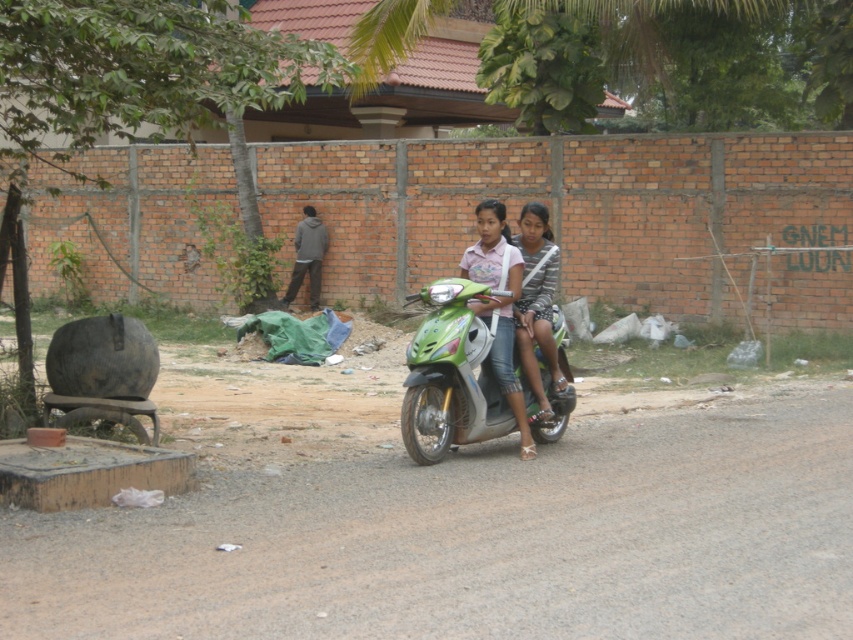
Where is `dirt track at lower center`? The height and width of the screenshot is (640, 853). dirt track at lower center is located at coordinates (480, 538).

The height and width of the screenshot is (640, 853). What are the coordinates of `dirt track at lower center` in the screenshot? It's located at (480, 538).

Between dirt track at lower center and striped fabric dress at center, which one is positioned higher?

Positioned higher is striped fabric dress at center.

Does dirt track at lower center have a greater height compared to striped fabric dress at center?

Incorrect, dirt track at lower center's height is not larger of striped fabric dress at center's.

Does point (775, 467) lie in front of point (566, 388)?

Yes.

This screenshot has height=640, width=853. Identify the location of dirt track at lower center. (480, 538).

Looking at this image, does pink fabric shirt at center lie in front of striped fabric dress at center?

That is True.

Is pink fabric shirt at center taller than striped fabric dress at center?

Indeed, pink fabric shirt at center has a greater height compared to striped fabric dress at center.

Is point (479, 253) positioned behind point (548, 237)?

That is False.

Identify the location of pink fabric shirt at center. (498, 305).